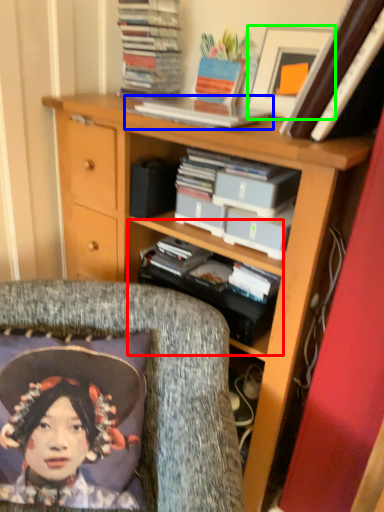
Question: Considering the real-world distances, which object is closest to shelf (highlighted by a red box)? book (highlighted by a blue box) or picture frame (highlighted by a green box).

Choices:
 (A) book
 (B) picture frame

Answer: (A)